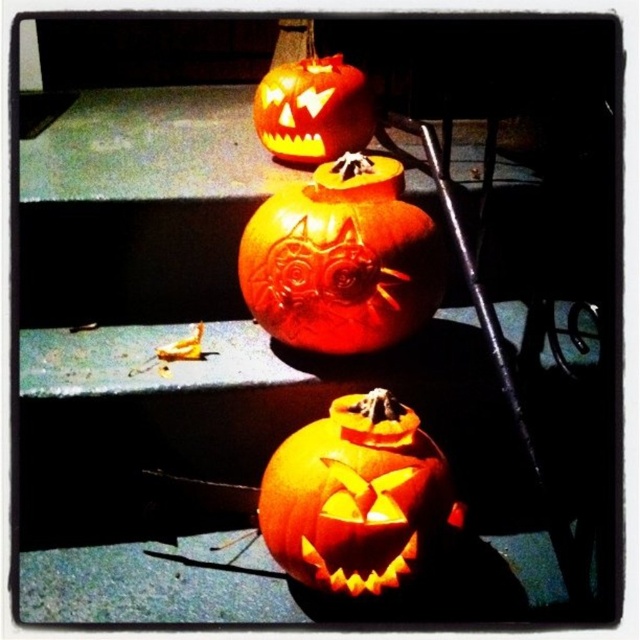
Question: Which point is farther from the camera taking this photo?

Choices:
 (A) (404, 212)
 (B) (320, 508)

Answer: (A)

Question: Is orange carved pumpkin at center further to camera compared to matte orange pumpkin at upper center?

Choices:
 (A) yes
 (B) no

Answer: (B)

Question: Which point is farther to the camera?

Choices:
 (A) orange matte pumpkin at center
 (B) matte orange pumpkin at upper center
 (C) orange carved pumpkin at center

Answer: (B)

Question: Which object is positioned closest to the orange matte pumpkin at center?

Choices:
 (A) matte orange pumpkin at upper center
 (B) orange carved pumpkin at center

Answer: (B)

Question: Is orange carved pumpkin at center smaller than orange matte pumpkin at center?

Choices:
 (A) no
 (B) yes

Answer: (A)

Question: Can you confirm if orange carved pumpkin at center is thinner than matte orange pumpkin at upper center?

Choices:
 (A) yes
 (B) no

Answer: (B)